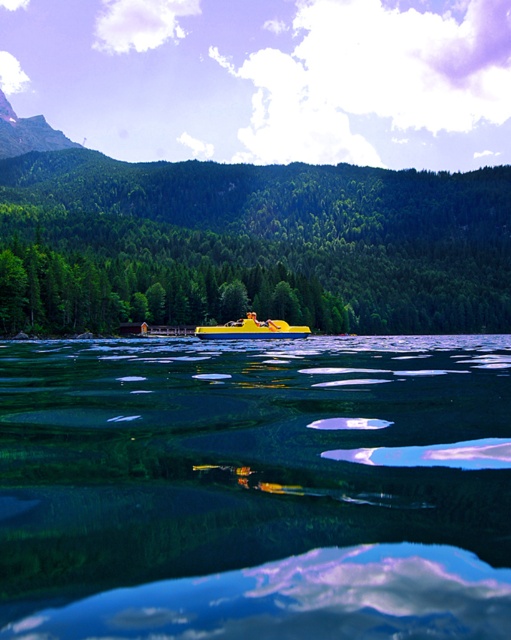
Question: Observing the image, what is the correct spatial positioning of yellow plastic boat at upper center in reference to green matte tree at center?

Choices:
 (A) below
 (B) above

Answer: (A)

Question: Which of the following is the closest to the observer?

Choices:
 (A) (200, 336)
 (B) (31, 548)
 (C) (45, 237)

Answer: (B)

Question: Does yellow plastic boat at upper center appear on the right side of yellow matte boat at center?

Choices:
 (A) yes
 (B) no

Answer: (A)

Question: Can you confirm if yellow plastic boat at upper center is positioned to the left of green matte tree at center?

Choices:
 (A) yes
 (B) no

Answer: (B)

Question: Which point is closer to the camera?

Choices:
 (A) yellow matte boat at center
 (B) yellow plastic boat at upper center
 (C) green matte tree at center

Answer: (B)

Question: Which of these objects is positioned closest to the green matte tree at center?

Choices:
 (A) yellow plastic boat at upper center
 (B) yellow matte boat at center

Answer: (B)